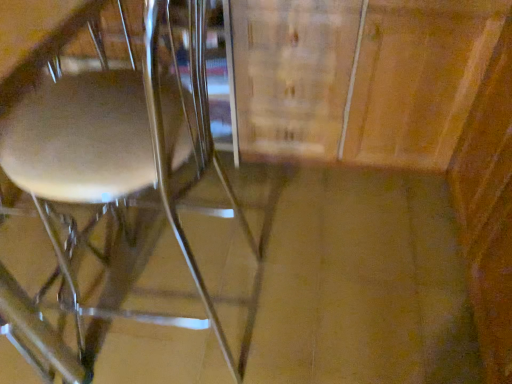
Question: Looking at the image, does metallic silver chair at left seem bigger or smaller compared to wooden cabinet at center?

Choices:
 (A) big
 (B) small

Answer: (A)

Question: Relative to wooden cabinet at center, is metallic silver chair at left in front or behind?

Choices:
 (A) behind
 (B) front

Answer: (B)

Question: Is metallic silver chair at left inside the boundaries of wooden cabinet at center, or outside?

Choices:
 (A) outside
 (B) inside

Answer: (A)

Question: Considering the positions of wooden cabinet at center and metallic silver chair at left in the image, is wooden cabinet at center bigger or smaller than metallic silver chair at left?

Choices:
 (A) big
 (B) small

Answer: (B)

Question: Based on their positions, is wooden cabinet at center located to the left or right of metallic silver chair at left?

Choices:
 (A) right
 (B) left

Answer: (A)

Question: From a real-world perspective, relative to metallic silver chair at left, is wooden cabinet at center vertically above or below?

Choices:
 (A) above
 (B) below

Answer: (B)

Question: From the image's perspective, is wooden cabinet at center located above or below metallic silver chair at left?

Choices:
 (A) above
 (B) below

Answer: (A)